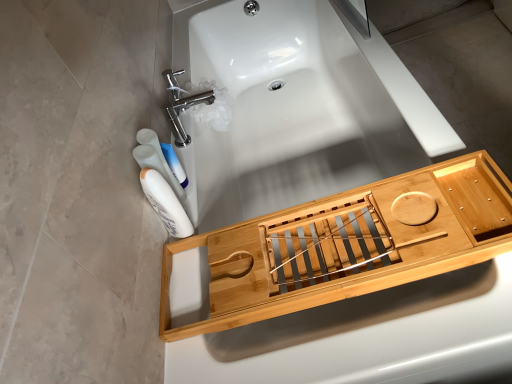
The height and width of the screenshot is (384, 512). I want to click on natural wood bath tray at center, so click(x=298, y=107).

What do you see at coordinates (298, 107) in the screenshot? I see `natural wood bath tray at center` at bounding box center [298, 107].

Where is `natural wood bath caddy at lower right`? The image size is (512, 384). natural wood bath caddy at lower right is located at coordinates (348, 245).

You are a GUI agent. You are given a task and a screenshot of the screen. Output one action in this format:
    pyautogui.click(x=<x>, y=<y>)
    Task: Click on the polished chrome faucet at upper left
    This screenshot has height=384, width=512.
    Given the screenshot: What is the action you would take?
    pyautogui.click(x=182, y=105)

Is white glossy bottle at lower left, the 1th mouthwash positioned from the back, taller or shorter than white glossy mouthwash at left, the second mouthwash when ordered from back to front?

white glossy bottle at lower left, the 1th mouthwash positioned from the back, is shorter than white glossy mouthwash at left, the second mouthwash when ordered from back to front.

Would you consider white glossy bottle at lower left, which ranks as the second mouthwash in front-to-back order, to be distant from white glossy mouthwash at left, the second mouthwash when ordered from back to front?

No, white glossy bottle at lower left, which ranks as the second mouthwash in front-to-back order, is not far from white glossy mouthwash at left, the second mouthwash when ordered from back to front.

Is white glossy bottle at lower left, the 1th mouthwash positioned from the back, smaller than white glossy mouthwash at left, the second mouthwash when ordered from back to front?

Correct, white glossy bottle at lower left, the 1th mouthwash positioned from the back, occupies less space than white glossy mouthwash at left, the second mouthwash when ordered from back to front.

Can natural wood bath tray at center be found inside white glossy bottle at lower left, the 1th mouthwash positioned from the back?

No.

Considering the relative sizes of white glossy bottle at lower left, the 1th mouthwash positioned from the back, and natural wood bath tray at center in the image provided, is white glossy bottle at lower left, the 1th mouthwash positioned from the back, wider than natural wood bath tray at center?

In fact, white glossy bottle at lower left, the 1th mouthwash positioned from the back, might be narrower than natural wood bath tray at center.

Who is taller, white glossy bottle at lower left, the 1th mouthwash positioned from the back, or natural wood bath tray at center?

With more height is natural wood bath tray at center.

Can white glossy bottle at lower left, which ranks as the second mouthwash in front-to-back order, be found inside polished chrome faucet at upper left?

No, white glossy bottle at lower left, which ranks as the second mouthwash in front-to-back order, is not surrounded by polished chrome faucet at upper left.

From a real-world perspective, is polished chrome faucet at upper left over white glossy bottle at lower left, the 1th mouthwash positioned from the back?

No, from a real-world perspective, polished chrome faucet at upper left is not over white glossy bottle at lower left, the 1th mouthwash positioned from the back

Can you confirm if polished chrome faucet at upper left is thinner than white glossy bottle at lower left, the 1th mouthwash positioned from the back?

In fact, polished chrome faucet at upper left might be wider than white glossy bottle at lower left, the 1th mouthwash positioned from the back.

Does polished chrome faucet at upper left have a lesser height compared to white glossy bottle at lower left, the 1th mouthwash positioned from the back?

Indeed, polished chrome faucet at upper left has a lesser height compared to white glossy bottle at lower left, the 1th mouthwash positioned from the back.

Which is behind, point (452, 177) or point (190, 96)?

The point (190, 96) is more distant.

Is natural wood bath caddy at lower right bigger or smaller than polished chrome faucet at upper left?

In the image, natural wood bath caddy at lower right appears to be larger than polished chrome faucet at upper left.

Is natural wood bath caddy at lower right positioned with its back to polished chrome faucet at upper left?

No, polished chrome faucet at upper left is not at the back of natural wood bath caddy at lower right.

From the picture: From a real-world perspective, does natural wood bath caddy at lower right stand above polished chrome faucet at upper left?

Incorrect, from a real-world perspective, natural wood bath caddy at lower right is lower than polished chrome faucet at upper left.

Which is correct: white glossy mouthwash at left, the second mouthwash when ordered from back to front, is inside white glossy bottle at lower left, which ranks as the second mouthwash in front-to-back order, or outside of it?

white glossy mouthwash at left, the second mouthwash when ordered from back to front, is outside white glossy bottle at lower left, which ranks as the second mouthwash in front-to-back order.

From the image's perspective, would you say white glossy mouthwash at left, which is the 1th mouthwash from front to back, is shown under white glossy bottle at lower left, which ranks as the second mouthwash in front-to-back order?

Indeed, from the image's perspective, white glossy mouthwash at left, which is the 1th mouthwash from front to back, is shown beneath white glossy bottle at lower left, which ranks as the second mouthwash in front-to-back order.

Is white glossy mouthwash at left, which is the 1th mouthwash from front to back, far from white glossy bottle at lower left, the 1th mouthwash positioned from the back?

No, white glossy mouthwash at left, which is the 1th mouthwash from front to back, is not far away from white glossy bottle at lower left, the 1th mouthwash positioned from the back.

Between white glossy mouthwash at left, which is the 1th mouthwash from front to back, and white glossy bottle at lower left, the 1th mouthwash positioned from the back, which one has larger size?

white glossy mouthwash at left, which is the 1th mouthwash from front to back.

Image resolution: width=512 pixels, height=384 pixels. Identify the location of bathroom cabinet on the right of white glossy bottle at lower left, which ranks as the second mouthwash in front-to-back order. (348, 245).

Does white glossy bottle at lower left, the 1th mouthwash positioned from the back, appear on the left side of natural wood bath caddy at lower right?

Yes, white glossy bottle at lower left, the 1th mouthwash positioned from the back, is to the left of natural wood bath caddy at lower right.

From a real-world perspective, between white glossy bottle at lower left, which ranks as the second mouthwash in front-to-back order, and natural wood bath caddy at lower right, who is vertically lower?

natural wood bath caddy at lower right, from a real-world perspective.

Does point (169, 222) come closer to viewer compared to point (282, 32)?

Yes, it is.

Image resolution: width=512 pixels, height=384 pixels. In order to click on bath in front of the white glossy mouthwash at left, which is the 1th mouthwash from front to back in this screenshot , I will do `click(298, 107)`.

From the image's perspective, which is below, white glossy mouthwash at left, the second mouthwash when ordered from back to front, or natural wood bath tray at center?

white glossy mouthwash at left, the second mouthwash when ordered from back to front, from the image's perspective.

In the image, is white glossy mouthwash at left, the second mouthwash when ordered from back to front, on the left side or the right side of natural wood bath tray at center?

Clearly, white glossy mouthwash at left, the second mouthwash when ordered from back to front, is on the left of natural wood bath tray at center in the image.

Where is `mouthwash on the left of the white glossy mouthwash at left, the second mouthwash when ordered from back to front`? The image size is (512, 384). mouthwash on the left of the white glossy mouthwash at left, the second mouthwash when ordered from back to front is located at coordinates (157, 167).

From a real-world perspective, starting from the natural wood bath tray at center, which mouthwash is the 1st one vertically above it? Please provide its 2D coordinates.

[(157, 167)]

Based on their spatial positions, is white glossy bottle at lower left, the 1th mouthwash positioned from the back, or natural wood bath tray at center closer to polished chrome faucet at upper left?

The object closer to polished chrome faucet at upper left is white glossy bottle at lower left, the 1th mouthwash positioned from the back.

Consider the image. Which object lies nearer to the anchor point white glossy mouthwash at left, the second mouthwash when ordered from back to front, polished chrome faucet at upper left or natural wood bath tray at center?

polished chrome faucet at upper left lies closer to white glossy mouthwash at left, the second mouthwash when ordered from back to front, than the other object.

Based on their spatial positions, is natural wood bath caddy at lower right or white glossy mouthwash at left, the second mouthwash when ordered from back to front, closer to white glossy bottle at lower left, the 1th mouthwash positioned from the back?

The object closer to white glossy bottle at lower left, the 1th mouthwash positioned from the back, is white glossy mouthwash at left, the second mouthwash when ordered from back to front.

Estimate the real-world distances between objects in this image. Which object is closer to white glossy bottle at lower left, the 1th mouthwash positioned from the back, polished chrome faucet at upper left or natural wood bath tray at center?

polished chrome faucet at upper left.

From the image, which object appears to be farther from natural wood bath caddy at lower right, polished chrome faucet at upper left or white glossy mouthwash at left, which is the 1th mouthwash from front to back?

The object further to natural wood bath caddy at lower right is polished chrome faucet at upper left.

Based on their spatial positions, is natural wood bath tray at center or white glossy mouthwash at left, which is the 1th mouthwash from front to back, further from polished chrome faucet at upper left?

The object further to polished chrome faucet at upper left is natural wood bath tray at center.

Estimate the real-world distances between objects in this image. Which object is further from polished chrome faucet at upper left, white glossy bottle at lower left, which ranks as the second mouthwash in front-to-back order, or natural wood bath caddy at lower right?

natural wood bath caddy at lower right lies further to polished chrome faucet at upper left than the other object.

Estimate the real-world distances between objects in this image. Which object is closer to white glossy mouthwash at left, the second mouthwash when ordered from back to front, natural wood bath tray at center or natural wood bath caddy at lower right?

Among the two, natural wood bath caddy at lower right is located nearer to white glossy mouthwash at left, the second mouthwash when ordered from back to front.

Locate an element on the screen. The width and height of the screenshot is (512, 384). bath situated between white glossy mouthwash at left, the second mouthwash when ordered from back to front, and natural wood bath caddy at lower right from left to right is located at coordinates pos(298,107).

The height and width of the screenshot is (384, 512). Find the location of `mouthwash between white glossy bottle at lower left, the 1th mouthwash positioned from the back, and natural wood bath tray at center from left to right`. mouthwash between white glossy bottle at lower left, the 1th mouthwash positioned from the back, and natural wood bath tray at center from left to right is located at coordinates click(x=165, y=203).

Identify the location of mouthwash between white glossy bottle at lower left, the 1th mouthwash positioned from the back, and natural wood bath caddy at lower right from left to right. (165, 203).

Where is `bath between white glossy bottle at lower left, the 1th mouthwash positioned from the back, and natural wood bath caddy at lower right`? The height and width of the screenshot is (384, 512). bath between white glossy bottle at lower left, the 1th mouthwash positioned from the back, and natural wood bath caddy at lower right is located at coordinates (298, 107).